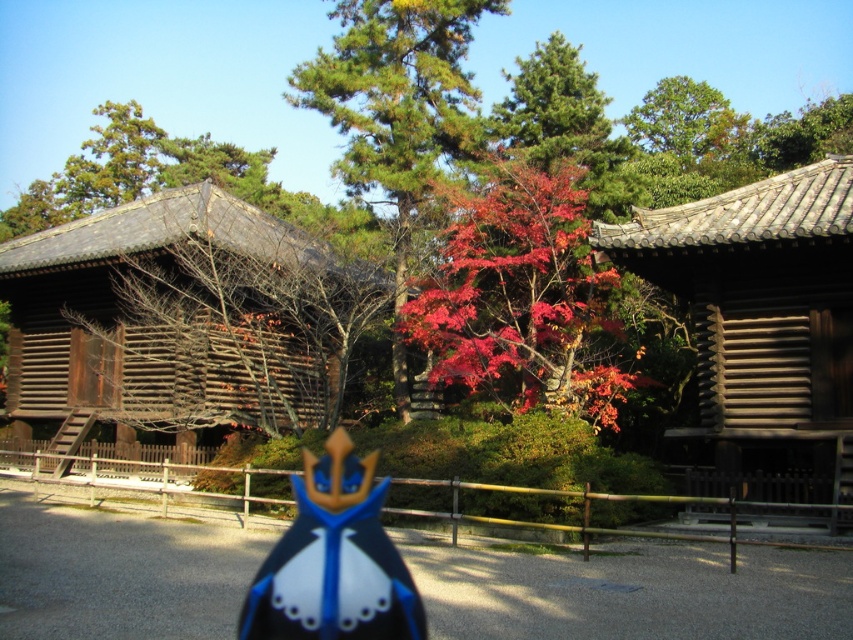
Question: Which of the following is the closest to the observer?

Choices:
 (A) (267, 355)
 (B) (387, 600)

Answer: (B)

Question: Can you confirm if wooden shingles hut at right is positioned above bright red leaves at center?

Choices:
 (A) no
 (B) yes

Answer: (A)

Question: Which object is the closest to the blue glossy crown at center?

Choices:
 (A) wooden shingles hut at right
 (B) reddish-brown bark tree at center
 (C) wooden hut at left
 (D) bright red leaves at center

Answer: (C)

Question: Is the position of wooden shingles hut at right less distant than that of green leafy tree at upper center?

Choices:
 (A) yes
 (B) no

Answer: (A)

Question: Where is reddish-brown bark tree at center located in relation to green leafy tree at upper center in the image?

Choices:
 (A) below
 (B) above

Answer: (B)

Question: Which of the following is the closest to the observer?

Choices:
 (A) (393, 372)
 (B) (570, 336)
 (C) (762, 339)
 (D) (329, 557)

Answer: (D)